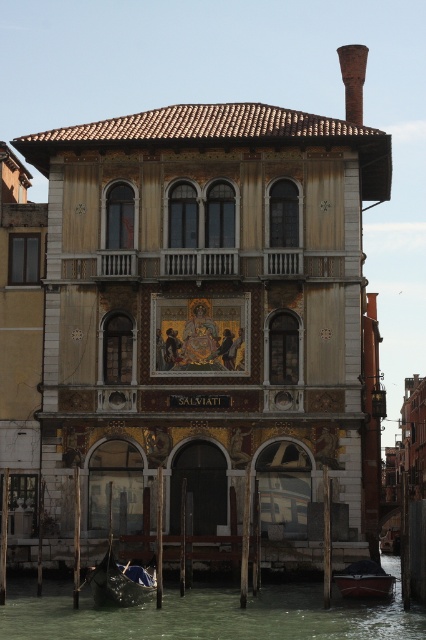
In the scene shown: You are a tourist standing on the canal bridge and want to take a photo of both the dark blue polished wood gondola at lower left and the dark blue wooden boat at lower center. Which boat should you focus on first to ensure both are in the frame?

You should focus on the dark blue polished wood gondola at lower left first since it is closer to the viewer, allowing you to adjust the camera angle to include both boats in the frame.

You are a tourist standing in front of the three story building along the canal. You notice two points marked on the building facade. The first point is at coordinates point (192, 625) and the second point is at point (118, 572). From your perspective, which point appears closer to you?

Point (192, 625) appears closer because it is in front of point (118, 572).